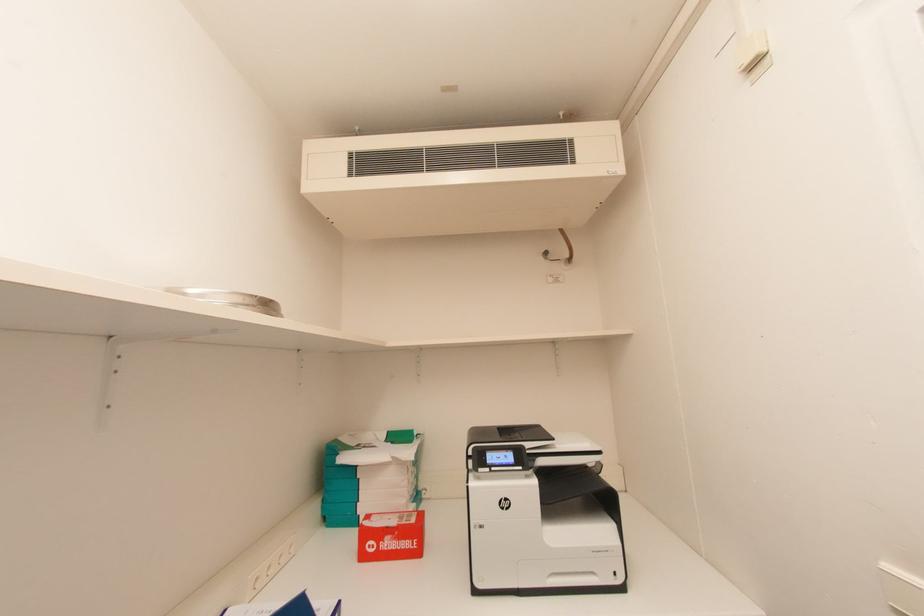
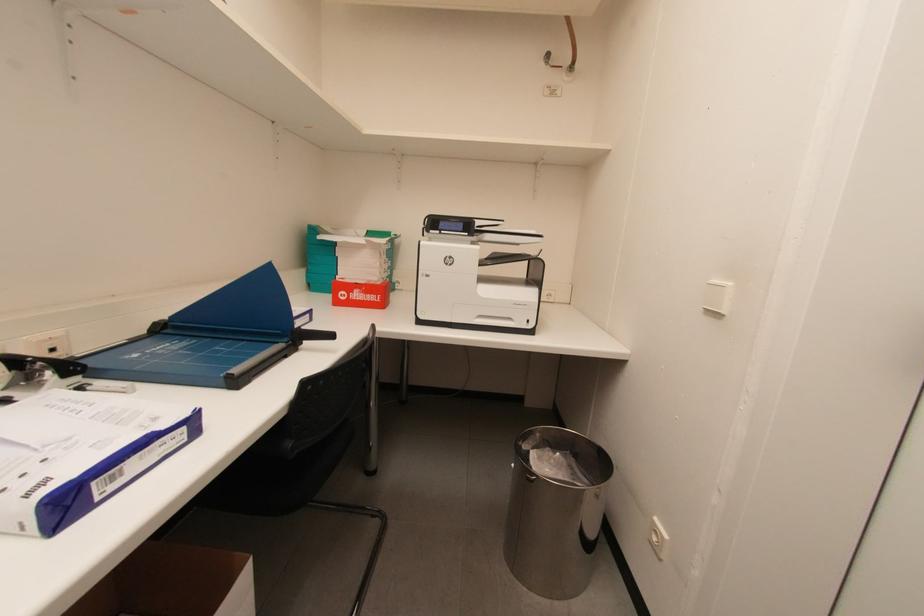
What movement of the cameraman would produce the second image?

The cameraman moved toward right, backward.